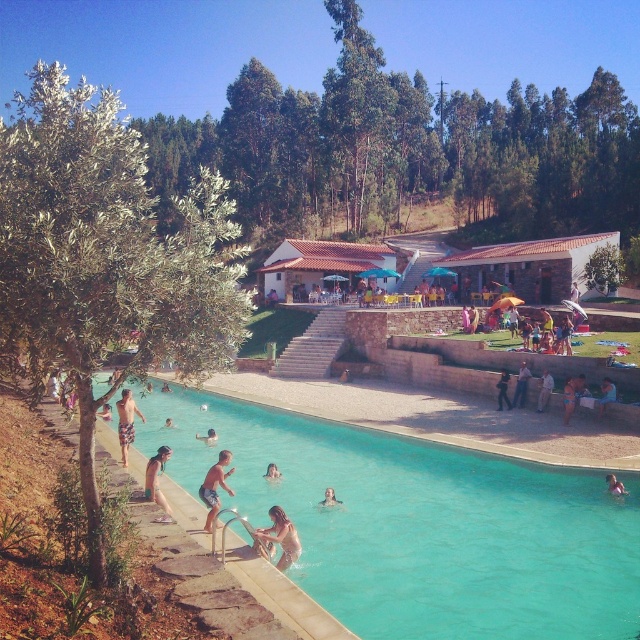
Question: Considering the real-world distances, which object is closest to the light blue fabric swimmer at lower center?

Choices:
 (A) smooth skin face at center
 (B) tan skin human at center
 (C) smooth skin person at lower left
 (D) dark blue jeans at lower center

Answer: (C)

Question: Does green fabric bikini at lower left have a smaller size compared to dark blue jeans at lower center?

Choices:
 (A) yes
 (B) no

Answer: (B)

Question: Based on their relative distances, which object is nearer to the leather jacket at lower right?

Choices:
 (A) light blue fabric swimmer at lower center
 (B) tan skin human at center
 (C) pink fabric person at lower right
 (D) smooth skin person at lower left

Answer: (C)

Question: Does tan skin human at center appear on the left side of dark blue jeans at lower center?

Choices:
 (A) no
 (B) yes

Answer: (B)

Question: Is green fabric bikini at lower left thinner than dark blue jeans at lower center?

Choices:
 (A) yes
 (B) no

Answer: (B)

Question: Which object is the closest to the green fabric bikini at lower left?

Choices:
 (A) smooth skin person at lower left
 (B) light blue fabric swimmer at lower center

Answer: (B)